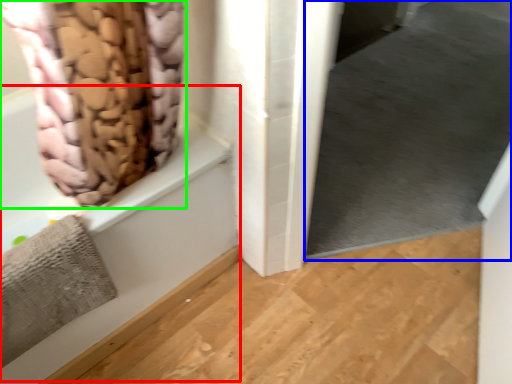
Question: Which object is positioned farthest from bath (highlighted by a red box)? Select from window screen (highlighted by a blue box) and curtain (highlighted by a green box).

Choices:
 (A) window screen
 (B) curtain

Answer: (A)